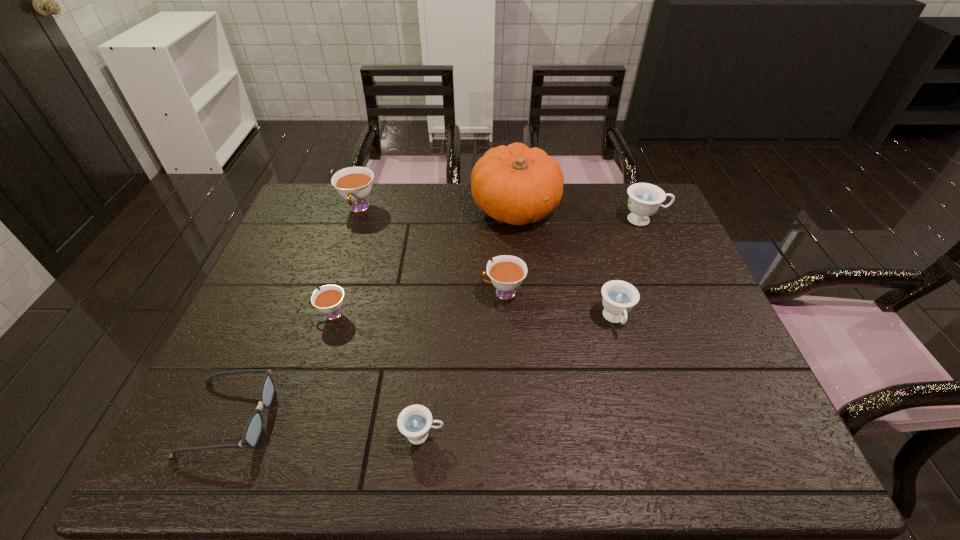
Locate an element on the screen. This screenshot has height=540, width=960. orange pumpkin is located at coordinates (515, 184).

Find the location of a particular element. pumpkin is located at coordinates (515, 184).

At what (x,y) coordinates should I click in order to perform the action: click on the farthest white teacup. Please return your answer as a coordinate pair (x, y). Image resolution: width=960 pixels, height=540 pixels. Looking at the image, I should click on (354, 184).

Identify the location of the farthest blue teacup. (644, 199).

Find the location of a particular element. the rightmost blue teacup is located at coordinates (644, 199).

At what (x,y) coordinates should I click in order to perform the action: click on the second biggest white teacup. Please return your answer as a coordinate pair (x, y). Image resolution: width=960 pixels, height=540 pixels. Looking at the image, I should click on (507, 272).

The height and width of the screenshot is (540, 960). I want to click on the rightmost white teacup, so click(x=507, y=272).

I want to click on the fifth teacup from left to right, so click(619, 297).

Locate an element on the screen. The image size is (960, 540). the second blue teacup from left to right is located at coordinates (619, 297).

Locate an element on the screen. The height and width of the screenshot is (540, 960). the smallest white teacup is located at coordinates (329, 300).